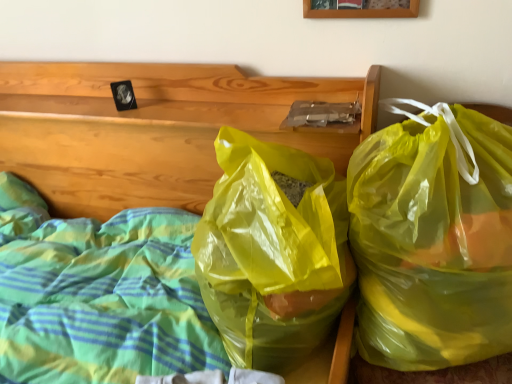
This screenshot has height=384, width=512. What do you see at coordinates (154, 129) in the screenshot?
I see `translucent plastic bags at center` at bounding box center [154, 129].

The width and height of the screenshot is (512, 384). I want to click on wooden picture frame at upper center, so click(362, 11).

Where is `yellow translucent bag at right`? yellow translucent bag at right is located at coordinates (432, 244).

At what (x,y) coordinates should I click in order to perform the action: click on furniture that is in front of the yellow translucent bag at right. Please return your answer as a coordinate pair (x, y). Image resolution: width=512 pixels, height=384 pixels. Looking at the image, I should click on (154, 129).

Can you tell me how much translucent plastic bags at center and yellow translucent bag at right differ in facing direction?

translucent plastic bags at center and yellow translucent bag at right are facing 0.856 degrees away from each other.

Which is in front, translucent plastic bags at center or yellow translucent bag at right?

translucent plastic bags at center is in front.

Considering the relative sizes of translucent plastic bags at center and yellow translucent bag at right in the image provided, is translucent plastic bags at center taller than yellow translucent bag at right?

Yes, translucent plastic bags at center is taller than yellow translucent bag at right.

Which of these two, translucent plastic bags at center or wooden picture frame at upper center, stands taller?

With more height is translucent plastic bags at center.

Based on the photo, considering the sizes of objects translucent plastic bags at center and wooden picture frame at upper center in the image provided, who is wider, translucent plastic bags at center or wooden picture frame at upper center?

Wider between the two is translucent plastic bags at center.

Where is `furniture below the wooden picture frame at upper center (from a real-world perspective)`? Image resolution: width=512 pixels, height=384 pixels. furniture below the wooden picture frame at upper center (from a real-world perspective) is located at coordinates (154, 129).

Is the position of translucent plastic bags at center more distant than that of wooden picture frame at upper center?

No, the depth of translucent plastic bags at center is less than that of wooden picture frame at upper center.

Is yellow translucent bag at right at the right side of wooden picture frame at upper center?

Yes, yellow translucent bag at right is to the right of wooden picture frame at upper center.

Looking at their sizes, would you say yellow translucent bag at right is wider or thinner than wooden picture frame at upper center?

yellow translucent bag at right is wider than wooden picture frame at upper center.

From a real-world perspective, relative to wooden picture frame at upper center, is yellow translucent bag at right vertically above or below?

Clearly, from a real-world perspective, yellow translucent bag at right is below wooden picture frame at upper center.

Measure the distance between yellow translucent bag at right and wooden picture frame at upper center.

19.45 inches.

Does wooden picture frame at upper center have a lesser width compared to yellow translucent bag at right?

Correct, the width of wooden picture frame at upper center is less than that of yellow translucent bag at right.

Consider the image. Is wooden picture frame at upper center taller or shorter than yellow translucent bag at right?

In the image, wooden picture frame at upper center appears to be shorter than yellow translucent bag at right.

Could you tell me if wooden picture frame at upper center is facing yellow translucent bag at right?

No.

Identify the location of plastic bag to the right of wooden picture frame at upper center. The image size is (512, 384). (432, 244).

From the image's perspective, which one is positioned higher, wooden picture frame at upper center or translucent plastic bags at center?

wooden picture frame at upper center appears higher in the image.

Who is smaller, wooden picture frame at upper center or translucent plastic bags at center?

With smaller size is wooden picture frame at upper center.

Can we say wooden picture frame at upper center lies outside translucent plastic bags at center?

Indeed, wooden picture frame at upper center is completely outside translucent plastic bags at center.

Consider the image. Which of these two, wooden picture frame at upper center or translucent plastic bags at center, stands taller?

Standing taller between the two is translucent plastic bags at center.

Considering the sizes of objects yellow translucent bag at right and translucent plastic bags at center in the image provided, who is shorter, yellow translucent bag at right or translucent plastic bags at center?

yellow translucent bag at right.

Consider the image. Is yellow translucent bag at right not within translucent plastic bags at center?

A: Yes, yellow translucent bag at right is located beyond the bounds of translucent plastic bags at center.

You are a GUI agent. You are given a task and a screenshot of the screen. Output one action in this format:
    pyautogui.click(x=<x>, y=<y>)
    Task: Click on the plastic bag beneath the translucent plastic bags at center (from a real-world perspective)
    
    Given the screenshot: What is the action you would take?
    pyautogui.click(x=432, y=244)

Between yellow translucent bag at right and translucent plastic bags at center, which one has larger size?

Bigger between the two is translucent plastic bags at center.

Where is `furniture above the yellow translucent bag at right (from a real-world perspective)`? furniture above the yellow translucent bag at right (from a real-world perspective) is located at coordinates (154, 129).

Identify the location of picture frame behind the translucent plastic bags at center. (362, 11).

Which object lies nearer to the anchor point wooden picture frame at upper center, translucent plastic bags at center or yellow translucent bag at right?

The object closer to wooden picture frame at upper center is yellow translucent bag at right.

Consider the image. Estimate the real-world distances between objects in this image. Which object is further from wooden picture frame at upper center, yellow translucent bag at right or translucent plastic bags at center?

Among the two, translucent plastic bags at center is located further to wooden picture frame at upper center.

Considering their positions, is yellow translucent bag at right positioned closer to translucent plastic bags at center than wooden picture frame at upper center?

yellow translucent bag at right lies closer to translucent plastic bags at center than the other object.

Considering their positions, is wooden picture frame at upper center positioned closer to translucent plastic bags at center than yellow translucent bag at right?

The object closer to translucent plastic bags at center is yellow translucent bag at right.

Consider the image. Estimate the real-world distances between objects in this image. Which object is closer to yellow translucent bag at right, translucent plastic bags at center or wooden picture frame at upper center?

translucent plastic bags at center is closer to yellow translucent bag at right.

Based on their spatial positions, is wooden picture frame at upper center or translucent plastic bags at center further from yellow translucent bag at right?

Based on the image, wooden picture frame at upper center appears to be further to yellow translucent bag at right.

Locate an element on the screen. Image resolution: width=512 pixels, height=384 pixels. picture frame between translucent plastic bags at center and yellow translucent bag at right from left to right is located at coordinates (362, 11).